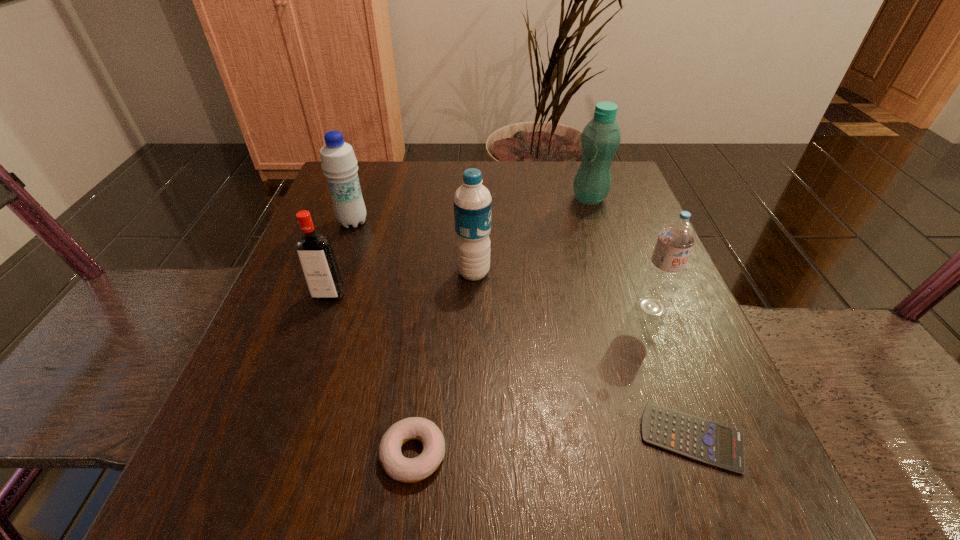
In the image, there is a desktop. Identify the location of vacant space at the right edge. (629, 381).

Image resolution: width=960 pixels, height=540 pixels. I want to click on vacant space at the far left corner of the desktop, so click(332, 211).

In the image, there is a desktop. Where is `vacant area at the near left corner`? vacant area at the near left corner is located at coordinates (221, 456).

Where is `vacant space at the far right corner`? Image resolution: width=960 pixels, height=540 pixels. vacant space at the far right corner is located at coordinates (595, 206).

The height and width of the screenshot is (540, 960). I want to click on vacant area that lies between the vodka and the calculator, so point(511,367).

Locate an element on the screen. empty space that is in between the third object from left to right and the calculator is located at coordinates (553, 446).

Locate an element on the screen. The width and height of the screenshot is (960, 540). free space between the leftmost water bottle and the second water bottle from left to right is located at coordinates (413, 247).

What are the coordinates of `free space between the sixth tallest object and the third water bottle from right to left` in the screenshot? It's located at (444, 363).

The image size is (960, 540). Find the location of `vacant region between the vodka and the third object from left to right`. vacant region between the vodka and the third object from left to right is located at coordinates (372, 374).

I want to click on free spot between the vodka and the sixth tallest object, so click(x=372, y=374).